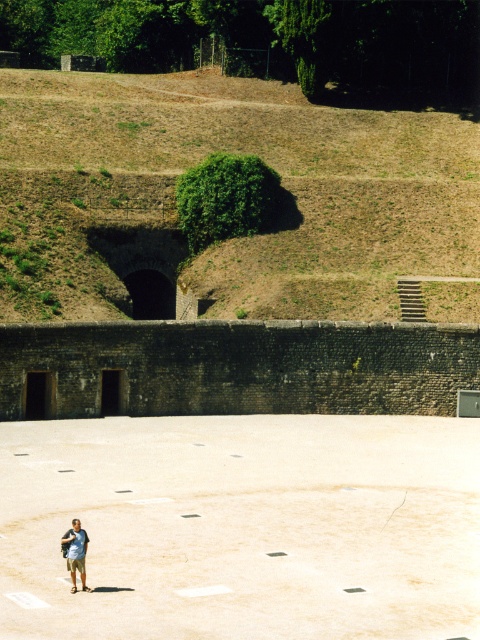
You are a photographer planning to take a photo of the smooth concrete skate park at center and the light blue cotton shirt at lower left. Which object should you focus on first if you want to capture both in sharp focus without adjusting the camera settings? Explain your reasoning based on their positions.

The smooth concrete skate park at center is much taller than the light blue cotton shirt at lower left. To capture both in sharp focus without adjusting the camera settings, you should focus on the smooth concrete skate park at center first because it is farther away and has a greater depth of field when focused on distant objects.

You are a hiker who wants to climb the brown earthy hillside at upper center. You see the light blue cotton shirt at lower left in the distance. Which object is taller?

The brown earthy hillside at upper center is much taller than the light blue cotton shirt at lower left.